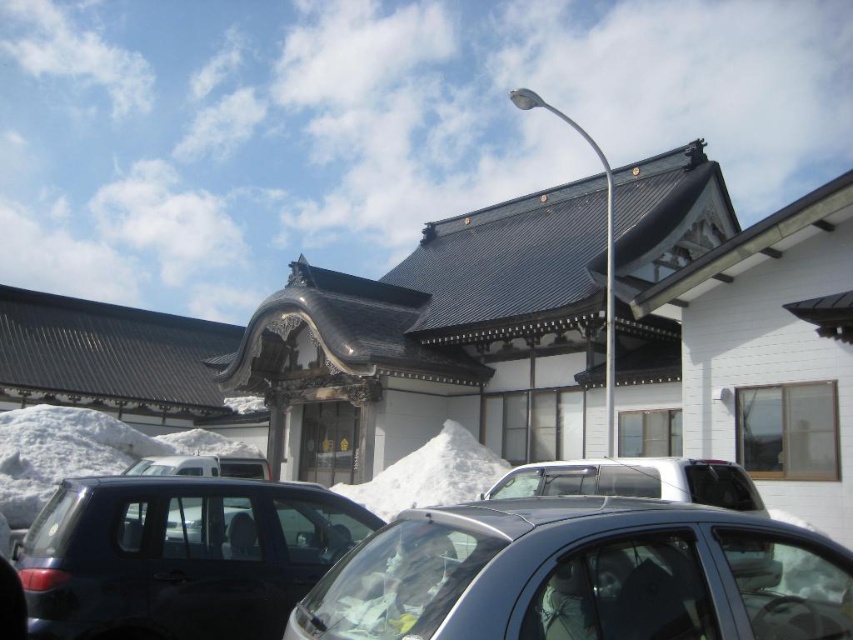
Is satin black suv at lower left positioned in front of white fluffy snow at center?

Yes, it is.

Identify the location of satin black suv at lower left. (178, 556).

Is point (64, 572) positioned before point (502, 465)?

Yes, it is.

Find the location of a particular element. satin black suv at lower left is located at coordinates (178, 556).

Who is positioned more to the left, satin black suv at lower left or satin silver car at center?

satin black suv at lower left is more to the left.

Image resolution: width=853 pixels, height=640 pixels. Describe the element at coordinates (178, 556) in the screenshot. I see `satin black suv at lower left` at that location.

Does point (62, 577) come behind point (601, 477)?

That is False.

Find the location of a particular element. The image size is (853, 640). satin black suv at lower left is located at coordinates (178, 556).

Where is `satin black car at center`? This screenshot has width=853, height=640. satin black car at center is located at coordinates (582, 576).

Between satin black car at center and white fluffy snow at center, which one is positioned higher?

satin black car at center

Where is `satin black car at center`? satin black car at center is located at coordinates (582, 576).